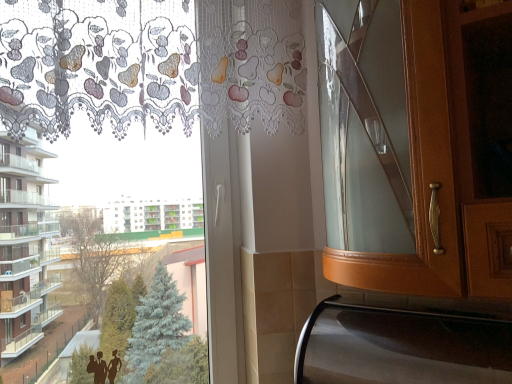
Question: From a real-world perspective, is shiny metallic oven at lower right located beneath white lace curtain at upper left?

Choices:
 (A) yes
 (B) no

Answer: (A)

Question: Are shiny metallic oven at lower right and white lace curtain at upper left making contact?

Choices:
 (A) yes
 (B) no

Answer: (B)

Question: Is shiny metallic oven at lower right positioned behind white lace curtain at upper left?

Choices:
 (A) yes
 (B) no

Answer: (B)

Question: Can you confirm if shiny metallic oven at lower right is taller than white lace curtain at upper left?

Choices:
 (A) yes
 (B) no

Answer: (B)

Question: Considering the relative sizes of shiny metallic oven at lower right and white lace curtain at upper left in the image provided, is shiny metallic oven at lower right thinner than white lace curtain at upper left?

Choices:
 (A) yes
 (B) no

Answer: (B)

Question: Is shiny metallic oven at lower right not near white lace curtain at upper left?

Choices:
 (A) yes
 (B) no

Answer: (B)

Question: Is white lace curtain at upper left oriented towards shiny metallic oven at lower right?

Choices:
 (A) yes
 (B) no

Answer: (B)

Question: From a real-world perspective, is white lace curtain at upper left physically below shiny metallic oven at lower right?

Choices:
 (A) no
 (B) yes

Answer: (A)

Question: Is white lace curtain at upper left not near shiny metallic oven at lower right?

Choices:
 (A) yes
 (B) no

Answer: (B)

Question: Considering the relative sizes of white lace curtain at upper left and shiny metallic oven at lower right in the image provided, is white lace curtain at upper left smaller than shiny metallic oven at lower right?

Choices:
 (A) no
 (B) yes

Answer: (A)

Question: From a real-world perspective, is white lace curtain at upper left over shiny metallic oven at lower right?

Choices:
 (A) no
 (B) yes

Answer: (B)

Question: From the image's perspective, does white lace curtain at upper left appear lower than shiny metallic oven at lower right?

Choices:
 (A) yes
 (B) no

Answer: (B)

Question: Is shiny metallic oven at lower right to the left or to the right of white lace curtain at upper left in the image?

Choices:
 (A) right
 (B) left

Answer: (A)